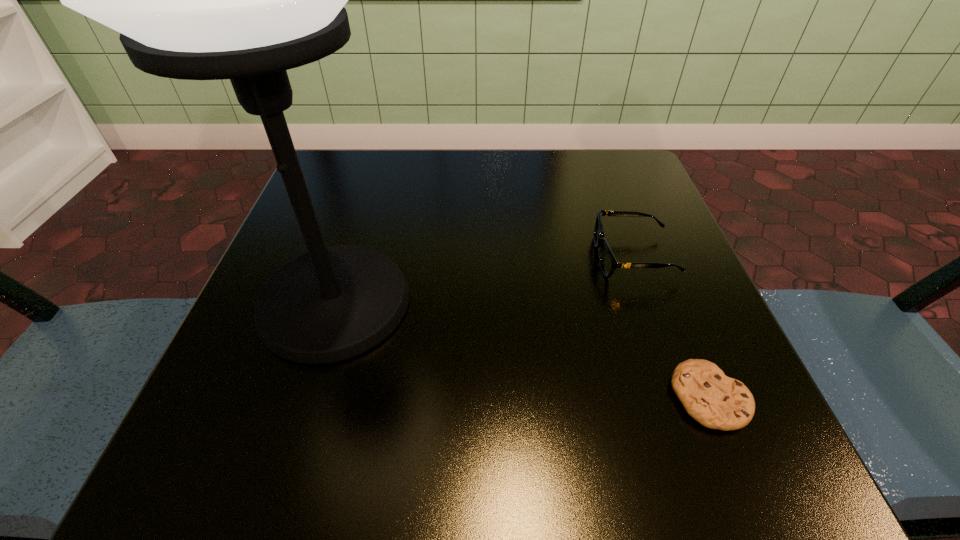
This screenshot has height=540, width=960. In order to click on free region that satisfies the following two spatial constraints: 1. on the front side of the shortest object; 2. on the right side of the leftmost object in this screenshot , I will do `click(305, 398)`.